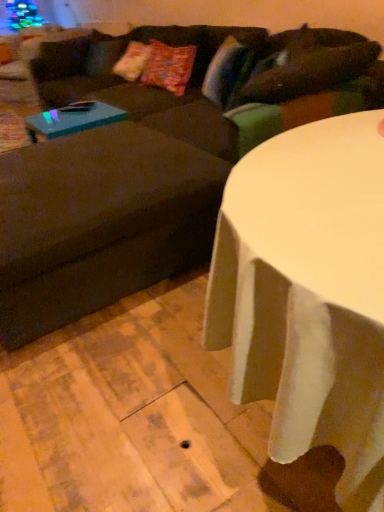
The height and width of the screenshot is (512, 384). Find the location of `free location to the left of white glossy table at center`. free location to the left of white glossy table at center is located at coordinates (107, 392).